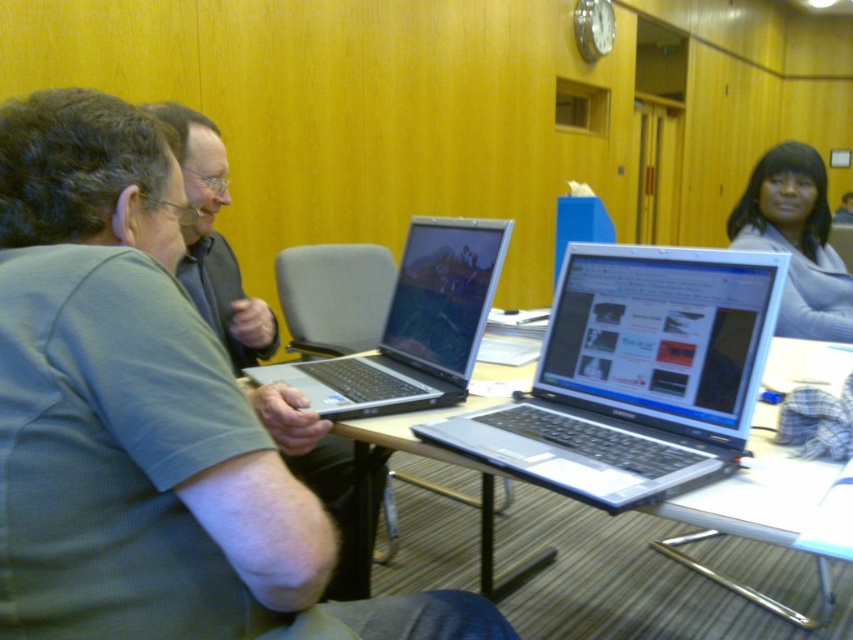
You are standing in the conference room and need to locate the silver metallic laptop at center. According to the coordinates provided, where exactly is it positioned?

The silver metallic laptop at center is positioned at point (635,376).